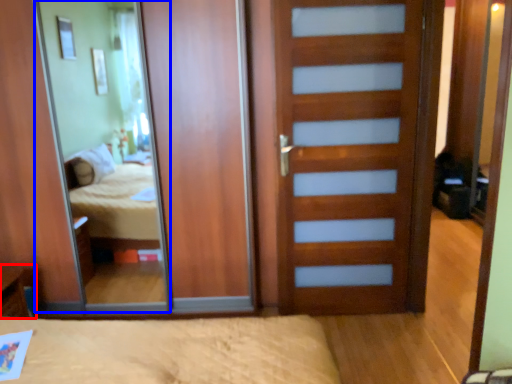
Question: Which point is further to the camera, table (highlighted by a red box) or mirror (highlighted by a blue box)?

Choices:
 (A) table
 (B) mirror

Answer: (B)